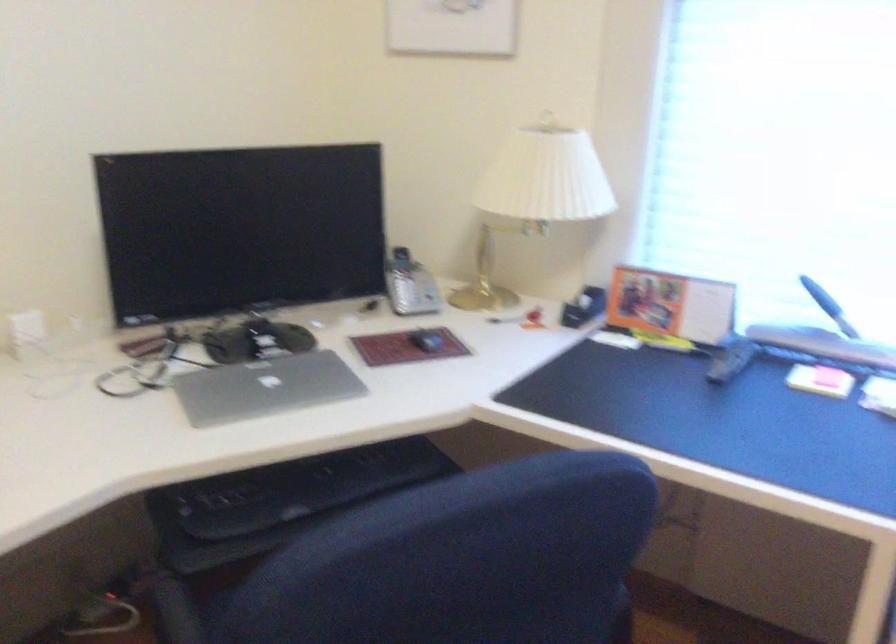
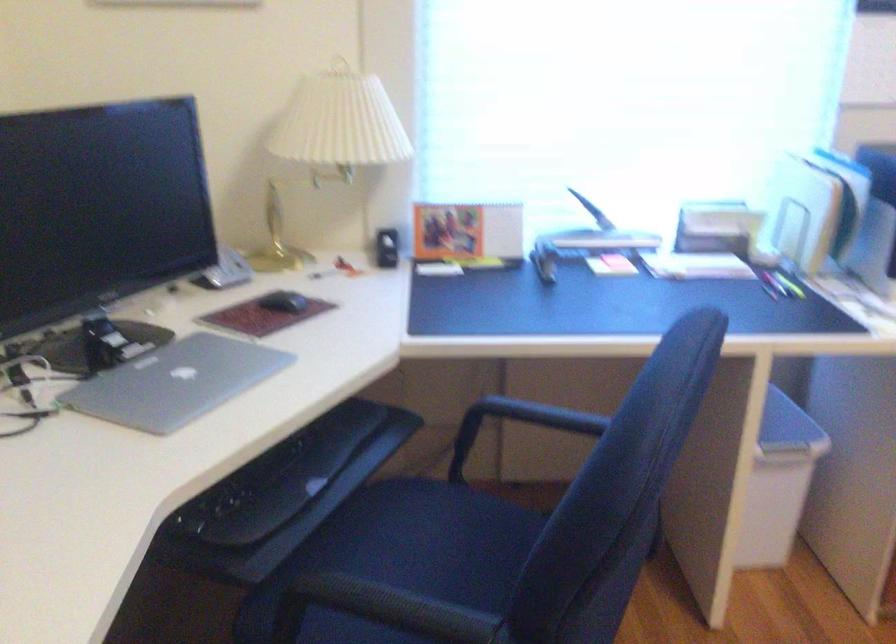
Question: The camera is either moving clockwise (left) or counter-clockwise (right) around the object. The first image is from the beginning of the video and the second image is from the end. Is the camera moving left or right when shooting the video?

Choices:
 (A) Left
 (B) Right

Answer: (A)